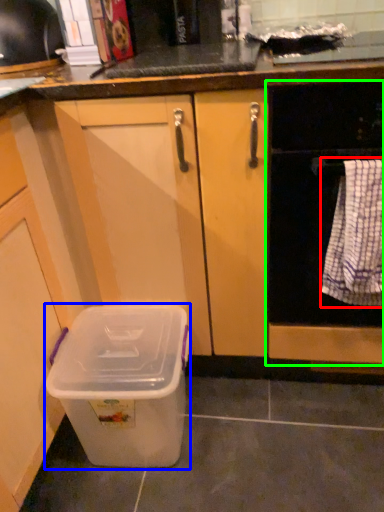
Question: Which is farther away from blanket (highlighted by a red box)? storage box (highlighted by a blue box) or home appliance (highlighted by a green box)?

Choices:
 (A) storage box
 (B) home appliance

Answer: (A)